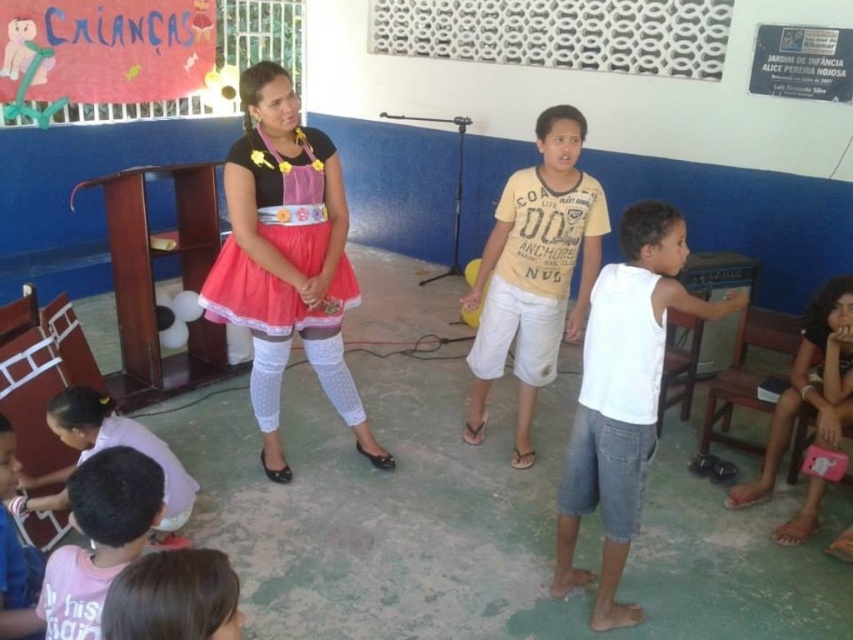
Question: Estimate the real-world distances between objects in this image. Which object is farther from the light pink fabric dress at lower left?

Choices:
 (A) matte pink purse at lower right
 (B) yellow cotton shirt at center

Answer: (A)

Question: Can you confirm if white cotton tank top at center is positioned below pink fabric shirt at lower left?

Choices:
 (A) yes
 (B) no

Answer: (B)

Question: Among these objects, which one is farthest from the camera?

Choices:
 (A) light pink fabric dress at lower left
 (B) white cotton tank top at center
 (C) matte pink purse at lower right

Answer: (C)

Question: Which point is farther to the camera?

Choices:
 (A) matte pink dress at center
 (B) pink fabric shirt at lower left
 (C) matte pink purse at lower right

Answer: (C)

Question: Is the position of matte pink dress at center less distant than that of yellow cotton shirt at center?

Choices:
 (A) yes
 (B) no

Answer: (A)

Question: Can you confirm if yellow cotton shirt at center is wider than pink fabric shirt at lower left?

Choices:
 (A) yes
 (B) no

Answer: (A)